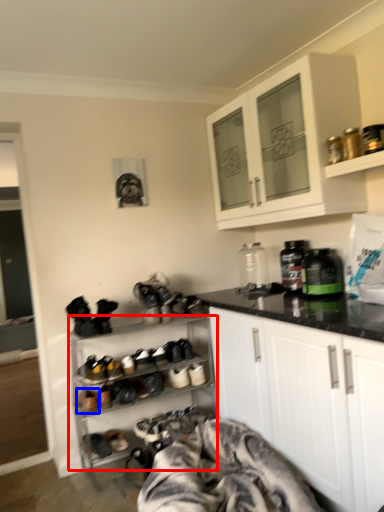
Question: Which of the following is the closest to the observer, shelf (highlighted by a red box) or footwear (highlighted by a blue box)?

Choices:
 (A) shelf
 (B) footwear

Answer: (A)